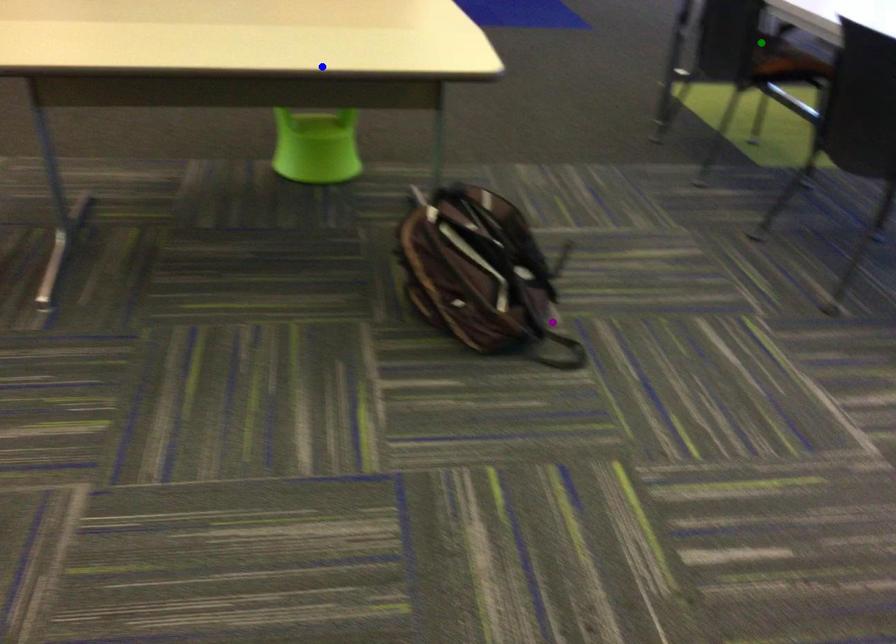
Order these from nearest to farthest:
purple point, blue point, green point

blue point → purple point → green point